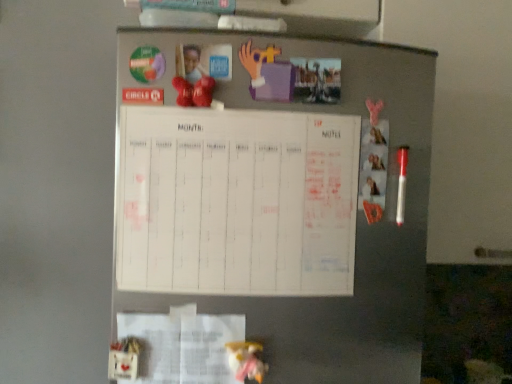
Question: Considering the relative sizes of white paper at lower left and white paperboard at center in the image provided, is white paper at lower left wider than white paperboard at center?

Choices:
 (A) no
 (B) yes

Answer: (A)

Question: Considering the relative sizes of white paper at lower left and white paperboard at center in the image provided, is white paper at lower left bigger than white paperboard at center?

Choices:
 (A) yes
 (B) no

Answer: (B)

Question: From a real-world perspective, is white paper at lower left located beneath white paperboard at center?

Choices:
 (A) no
 (B) yes

Answer: (B)

Question: Can you confirm if white paper at lower left is shorter than white paperboard at center?

Choices:
 (A) no
 (B) yes

Answer: (B)

Question: Can you confirm if white paper at lower left is smaller than white paperboard at center?

Choices:
 (A) no
 (B) yes

Answer: (B)

Question: From the image's perspective, is white paper at lower left located beneath white paperboard at center?

Choices:
 (A) no
 (B) yes

Answer: (B)

Question: Can you confirm if white fabric doll at lower center is bigger than white paperboard at center?

Choices:
 (A) yes
 (B) no

Answer: (B)

Question: From the image's perspective, is white fabric doll at lower center located above white paperboard at center?

Choices:
 (A) yes
 (B) no

Answer: (B)

Question: Is white fabric doll at lower center at the left side of white paperboard at center?

Choices:
 (A) no
 (B) yes

Answer: (A)

Question: Is white fabric doll at lower center facing away from white paperboard at center?

Choices:
 (A) yes
 (B) no

Answer: (B)

Question: Is white fabric doll at lower center oriented towards white paperboard at center?

Choices:
 (A) no
 (B) yes

Answer: (A)

Question: Can you confirm if white fabric doll at lower center is wider than white paperboard at center?

Choices:
 (A) no
 (B) yes

Answer: (A)

Question: Is white paper at lower left located within white fabric doll at lower center?

Choices:
 (A) yes
 (B) no

Answer: (B)